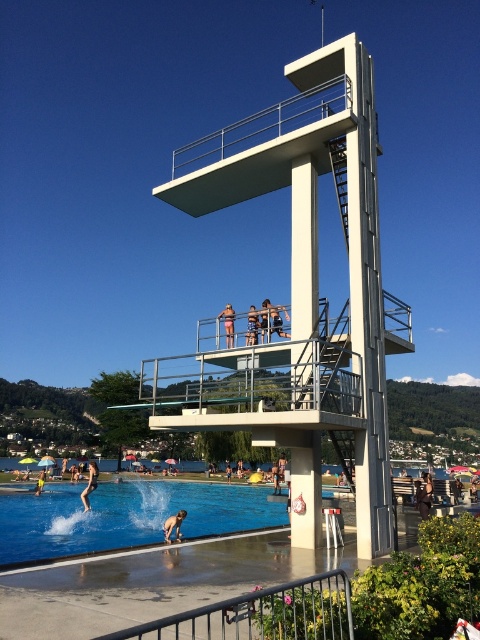
Question: Does blue glossy water at lower left lie behind blue denim shorts at upper center?

Choices:
 (A) yes
 (B) no

Answer: (A)

Question: Can you confirm if metallic silver railing at lower center is bigger than smooth skin person at lower right?

Choices:
 (A) no
 (B) yes

Answer: (A)

Question: Which point appears farthest from the camera in this image?

Choices:
 (A) (175, 490)
 (B) (349, 451)

Answer: (A)

Question: Considering the relative positions of tan skin person at center and smooth skin person at center in the image provided, where is tan skin person at center located with respect to smooth skin person at center?

Choices:
 (A) left
 (B) right

Answer: (B)

Question: Estimate the real-world distances between objects in this image. Which object is farther from the blue denim shorts at upper center?

Choices:
 (A) dark blue swimsuit at lower left
 (B) blue glossy water at lower left

Answer: (B)

Question: Among these objects, which one is farthest from the camera?

Choices:
 (A) yellow fabric person at lower left
 (B) tan skin person at center

Answer: (A)